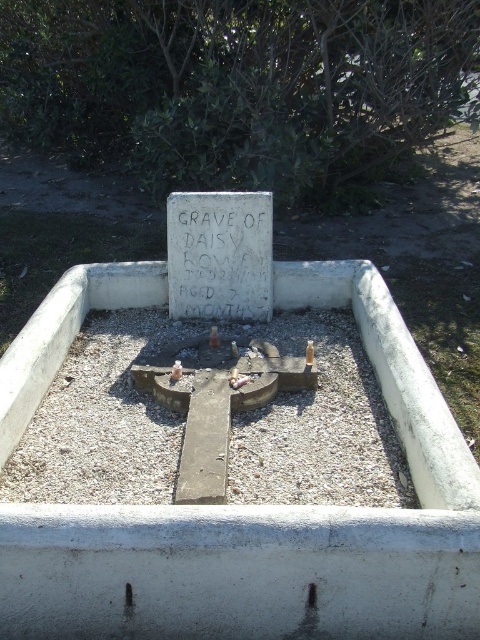
You are standing at the edge of the grave enclosure and want to place a flower bouquet on the gray gravel at center. Where exactly should you aim to place it?

You should aim to place the flower bouquet at the coordinates point [101,420] where the gray gravel at center is located.

You are standing in front of the grave marker and want to place a small flower at one of the two points marked. Which point, point (287,531) or point (291,410), is closer to you?

Point (287,531) is closer to the camera than point (291,410), so you should place the flower at point (287,531) since it is closer to you.